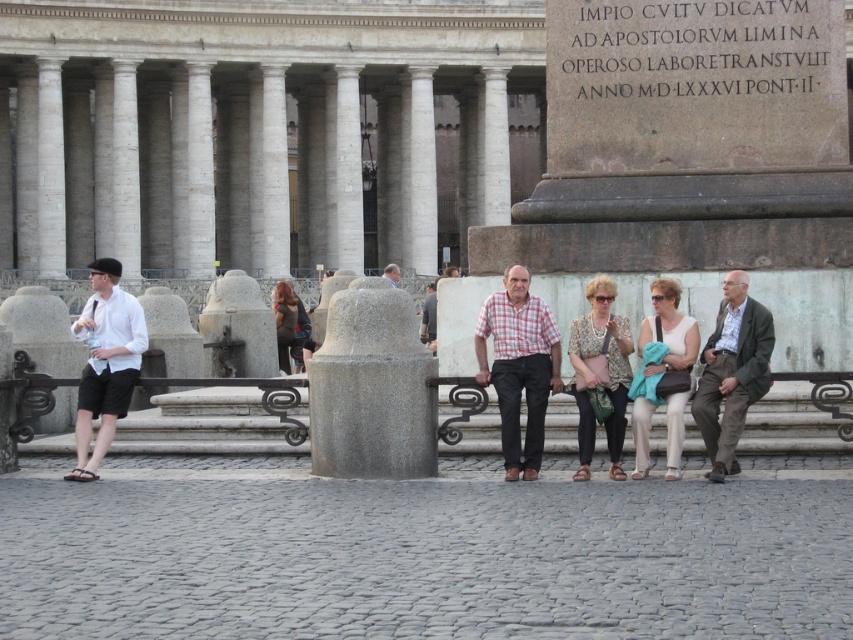
Question: Which point is farther to the camera?

Choices:
 (A) white cotton shirt at left
 (B) white cotton dress at center
 (C) checkered fabric shirt at center
 (D) matte brown coat at center

Answer: (D)

Question: Does white cotton shirt at left come in front of smooth gray stone statue at center?

Choices:
 (A) yes
 (B) no

Answer: (A)

Question: Can you confirm if checkered fabric shirt at center is thinner than smooth gray stone statue at center?

Choices:
 (A) yes
 (B) no

Answer: (A)

Question: Which object is closer to the camera taking this photo?

Choices:
 (A) white cotton dress at center
 (B) smooth gray stone statue at center
 (C) checkered fabric shirt at center

Answer: (C)

Question: Does floral print blouse at center have a greater width compared to white cotton dress at center?

Choices:
 (A) no
 (B) yes

Answer: (B)

Question: Which of the following is the farthest from the observer?

Choices:
 (A) white cotton dress at center
 (B) checkered fabric shirt at center
 (C) white cotton shirt at left

Answer: (A)